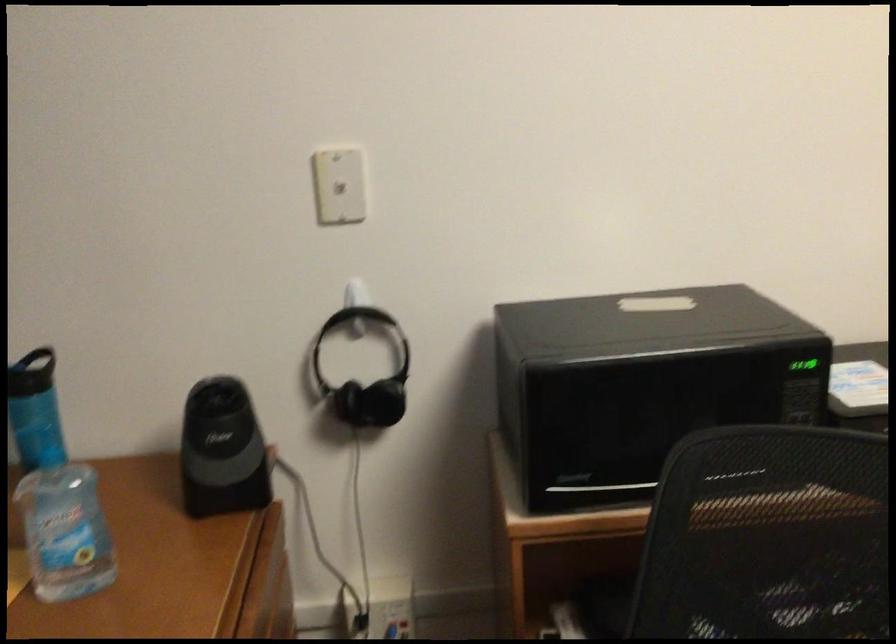
Describe the element at coordinates (339, 185) in the screenshot. The height and width of the screenshot is (644, 896). I see `the light switch` at that location.